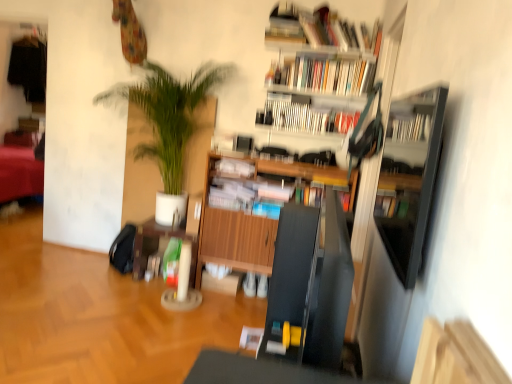
Question: Should I look upward or downward to see hardcover books at upper center, the fourth book positioned from the bottom?

Choices:
 (A) up
 (B) down

Answer: (A)

Question: Is hardcover book at upper center, which appears as the third book when viewed from the top, at the right side of hardcover books at upper center, the third book from the bottom?

Choices:
 (A) no
 (B) yes

Answer: (A)

Question: Is hardcover book at upper center, which appears as the third book when viewed from the top, taller than hardcover books at upper center, the third book from the bottom?

Choices:
 (A) no
 (B) yes

Answer: (A)

Question: From the image's perspective, is hardcover book at upper center, which is counted as the 2th book, starting from the bottom, located above hardcover books at upper center, the 2th book when ordered from top to bottom?

Choices:
 (A) yes
 (B) no

Answer: (B)

Question: Does hardcover book at upper center, which is counted as the 2th book, starting from the bottom, have a smaller size compared to hardcover books at upper center, the 2th book when ordered from top to bottom?

Choices:
 (A) yes
 (B) no

Answer: (A)

Question: Is hardcover book at upper center, which is counted as the 2th book, starting from the bottom, positioned with its back to hardcover books at upper center, the 2th book when ordered from top to bottom?

Choices:
 (A) no
 (B) yes

Answer: (A)

Question: Does hardcover book at upper center, which is counted as the 2th book, starting from the bottom, have a lesser height compared to hardcover books at upper center, the 2th book when ordered from top to bottom?

Choices:
 (A) yes
 (B) no

Answer: (A)

Question: From a real-world perspective, is hardcover books at upper center, the 2th book when ordered from top to bottom, under wooden cabinet at center?

Choices:
 (A) yes
 (B) no

Answer: (B)

Question: Does hardcover books at upper center, the 2th book when ordered from top to bottom, have a greater height compared to wooden cabinet at center?

Choices:
 (A) yes
 (B) no

Answer: (B)

Question: Are hardcover books at upper center, the third book from the bottom, and wooden cabinet at center located far from each other?

Choices:
 (A) no
 (B) yes

Answer: (B)

Question: From the image's perspective, is hardcover books at upper center, the 2th book when ordered from top to bottom, on wooden cabinet at center?

Choices:
 (A) yes
 (B) no

Answer: (A)

Question: Does hardcover books at upper center, the third book from the bottom, appear on the left side of wooden cabinet at center?

Choices:
 (A) yes
 (B) no

Answer: (B)

Question: Is hardcover books at upper center, the 2th book when ordered from top to bottom, in front of wooden cabinet at center?

Choices:
 (A) yes
 (B) no

Answer: (A)

Question: Would you say wooden bookshelf at upper center is part of hardcover books at upper center, the fourth book positioned from the bottom,'s contents?

Choices:
 (A) no
 (B) yes

Answer: (A)